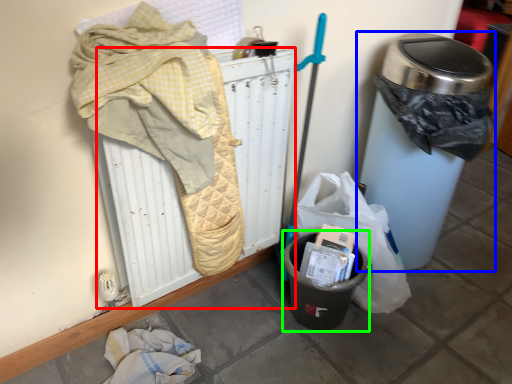
Question: Based on their relative distances, which object is nearer to radiator (highlighted by a red box)? Choose from waste container (highlighted by a blue box) and recycling bin (highlighted by a green box).

Choices:
 (A) waste container
 (B) recycling bin

Answer: (B)